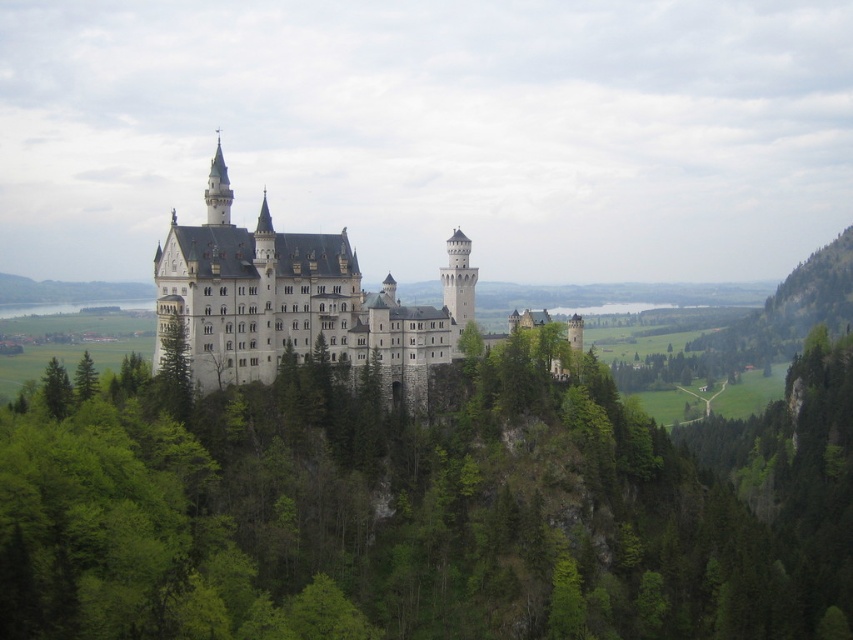
Question: Which object is positioned farthest from the green leafy tree at center?

Choices:
 (A) green textured tree at center
 (B) white stone castle at center

Answer: (A)

Question: Can you confirm if white stone castle at center is wider than green leafy tree at lower left?

Choices:
 (A) no
 (B) yes

Answer: (B)

Question: Is green leafy tree at center below green matte tree at lower left?

Choices:
 (A) no
 (B) yes

Answer: (B)

Question: Does green textured tree at center appear on the right side of green leafy tree at lower left?

Choices:
 (A) no
 (B) yes

Answer: (B)

Question: Which object is the closest to the green textured tree at center?

Choices:
 (A) green leafy tree at lower left
 (B) green leafy tree at center

Answer: (A)

Question: Estimate the real-world distances between objects in this image. Which object is farther from the green leafy tree at center?

Choices:
 (A) white stone castle at center
 (B) green textured tree at center

Answer: (B)